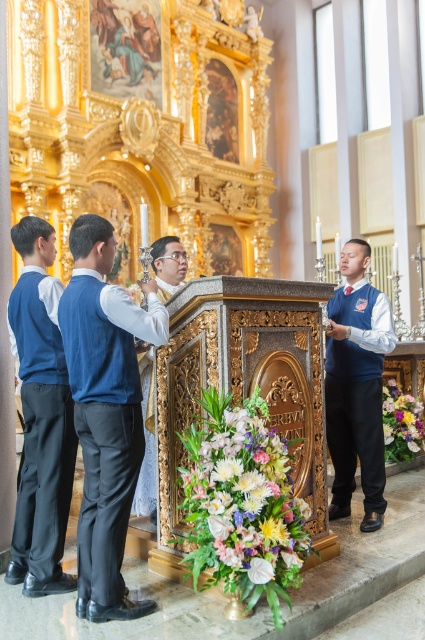
You are standing in the church and want to place a small bouquet of flowers exactly at point (133, 483). Given that you can reach up to 2 meters, can you place the bouquet there without moving closer?

The distance between you and point (133, 483) is 3.52 meters, which is farther than your maximum reach of 2 meters. Therefore, you cannot place the bouquet there without moving closer.

You are a photographer positioned at the entrance of the church. You want to capture a photo of the floral bouquet at lower center and the matte gold vest at center such that the bouquet is on the left side of the photo. Is the current arrangement suitable for this requirement?

The floral bouquet at lower center is to the right of the matte gold vest at center, so in the current arrangement, the bouquet would appear on the right side of the photo. To have the bouquet on the left, you would need to adjust their positions.